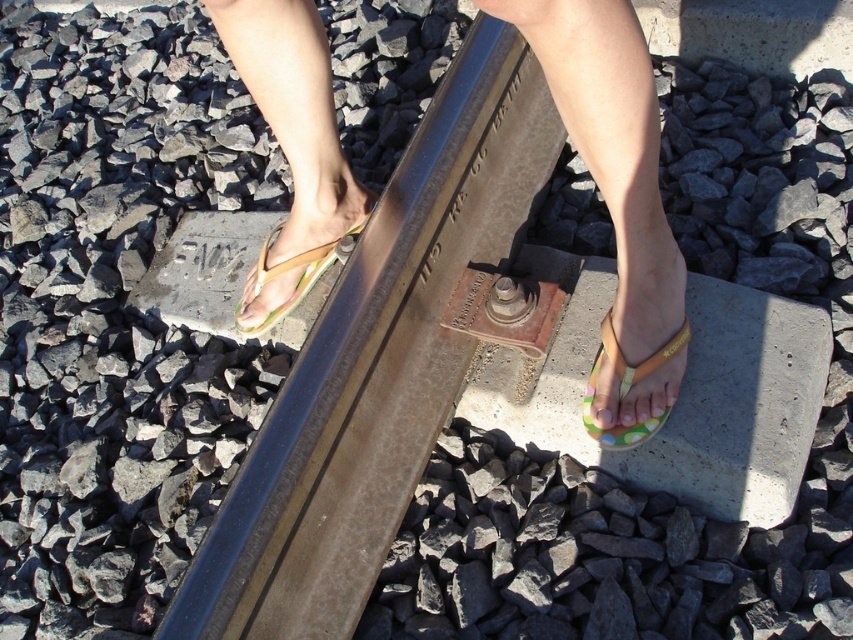
You are a railway inspector checking the track stability. You notice a point at coordinate (677, 394). What type of material is present at this point?

The point at coordinate (677, 394) is a smooth concrete block at center, which is part of the railway infrastructure designed to support the tracks and ensure stability.